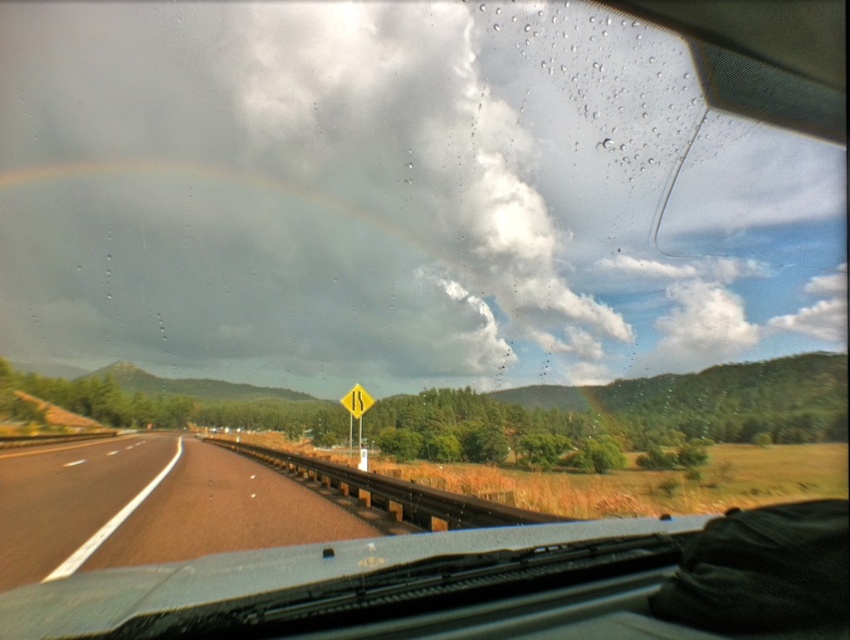
You are a driver navigating a route and need to stay on the brown asphalt highway at center. According to the coordinates provided, where should you position your vehicle to remain on the correct path?

The brown asphalt highway at center is located at coordinates point (204,504), so you should position your vehicle near that point to stay on the correct path.

You are driving a car and want to know how far the brown asphalt highway at center is from your current position. Can you determine the distance based on the scene?

The brown asphalt highway at center is 11.53 meters away from the viewer, so the distance is approximately 11.53 meters.

You are a passenger in the car and looking out the windshield. You see the white fluffy cloud at upper center and the brown asphalt highway at center. Which one is closer to you?

The white fluffy cloud at upper center is closer to you because the brown asphalt highway at center is behind it.